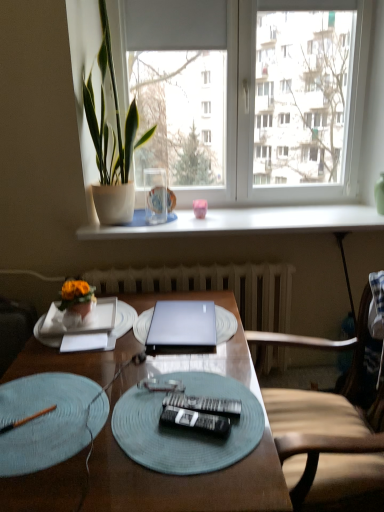
Identify the location of free location to the left of black plastic remote control at center, marked as the second remote control in a back-to-front arrangement. 126,430.